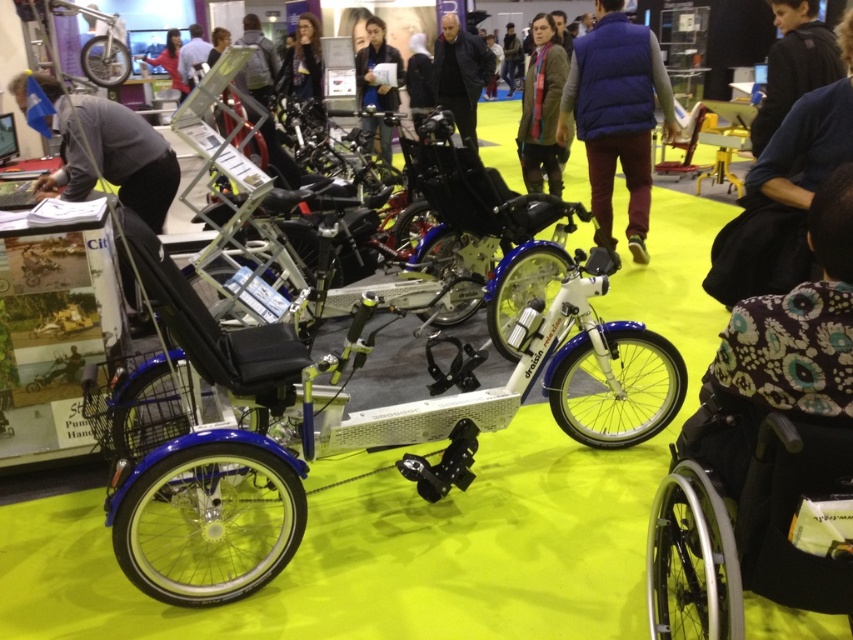
Is blue down vest at center in front of gray fabric at left?

No.

Is blue down vest at center smaller than gray fabric at left?

Yes.

The image size is (853, 640). What are the coordinates of `blue down vest at center` in the screenshot? It's located at (618, 113).

The height and width of the screenshot is (640, 853). Describe the element at coordinates (744, 524) in the screenshot. I see `black plastic wheelchair at lower right` at that location.

What are the coordinates of `black plastic wheelchair at lower right` in the screenshot? It's located at (744, 524).

Find the location of a particular element. Image resolution: width=853 pixels, height=640 pixels. black plastic wheelchair at lower right is located at coordinates tap(744, 524).

Locate an element on the screen. The width and height of the screenshot is (853, 640). black plastic wheelchair at lower right is located at coordinates (744, 524).

Looking at this image, does dark blue fabric at lower right have a greater height compared to black fabric jacket at upper right?

Correct, dark blue fabric at lower right is much taller as black fabric jacket at upper right.

Can you confirm if dark blue fabric at lower right is thinner than black fabric jacket at upper right?

No, dark blue fabric at lower right is not thinner than black fabric jacket at upper right.

Identify the location of dark blue fabric at lower right. The height and width of the screenshot is (640, 853). (784, 193).